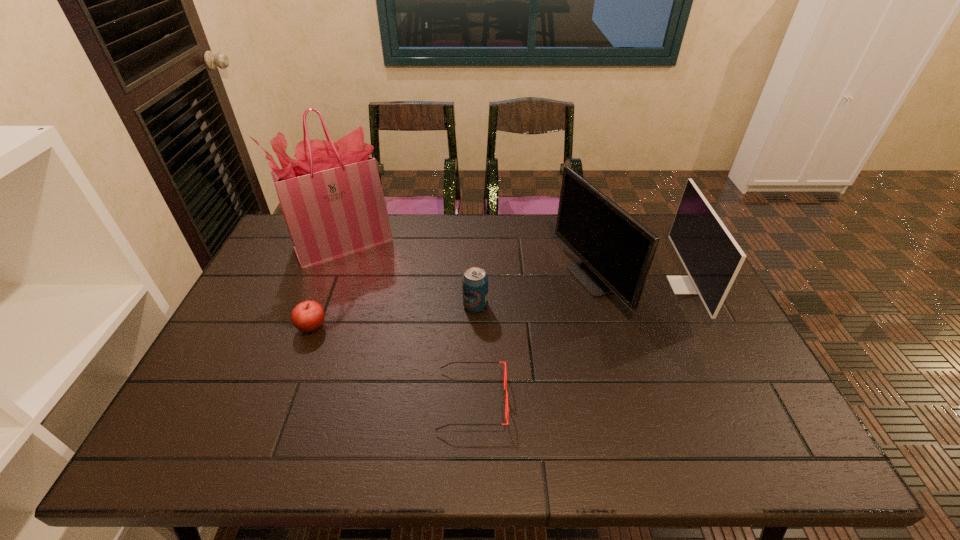
At what (x,y) coordinates should I click in order to perform the action: click on vacant space located 0.330m on the front-facing side of the fifth object from left to right. Please return your answer as a coordinate pair (x, y). The height and width of the screenshot is (540, 960). Looking at the image, I should click on (454, 279).

You are a GUI agent. You are given a task and a screenshot of the screen. Output one action in this format:
    pyautogui.click(x=<x>, y=<y>)
    Task: Click on the vacant space located on the front-facing side of the rightmost object
    
    Given the screenshot: What is the action you would take?
    pyautogui.click(x=614, y=285)

Find the location of `vacant space located 0.390m on the front-facing side of the rightmost object`. vacant space located 0.390m on the front-facing side of the rightmost object is located at coordinates (542, 285).

Find the location of `free region located on the front-facing side of the rightmost object`. free region located on the front-facing side of the rightmost object is located at coordinates (540, 285).

You are a GUI agent. You are given a task and a screenshot of the screen. Output one action in this format:
    pyautogui.click(x=<x>, y=<y>)
    Task: Click on the vacant space located 0.380m on the back of the pop soda
    
    Given the screenshot: What is the action you would take?
    pyautogui.click(x=476, y=223)

This screenshot has height=540, width=960. Identify the location of vacant point located 0.300m on the back of the apple. (341, 250).

Where is `free spot located 0.220m on the front-facing side of the shortest object`? The width and height of the screenshot is (960, 540). free spot located 0.220m on the front-facing side of the shortest object is located at coordinates (598, 400).

Where is `shopping bag that is at the far edge`? The image size is (960, 540). shopping bag that is at the far edge is located at coordinates (331, 197).

Where is `object present at the near edge`? object present at the near edge is located at coordinates (505, 374).

The image size is (960, 540). I want to click on object present at the left edge, so click(331, 197).